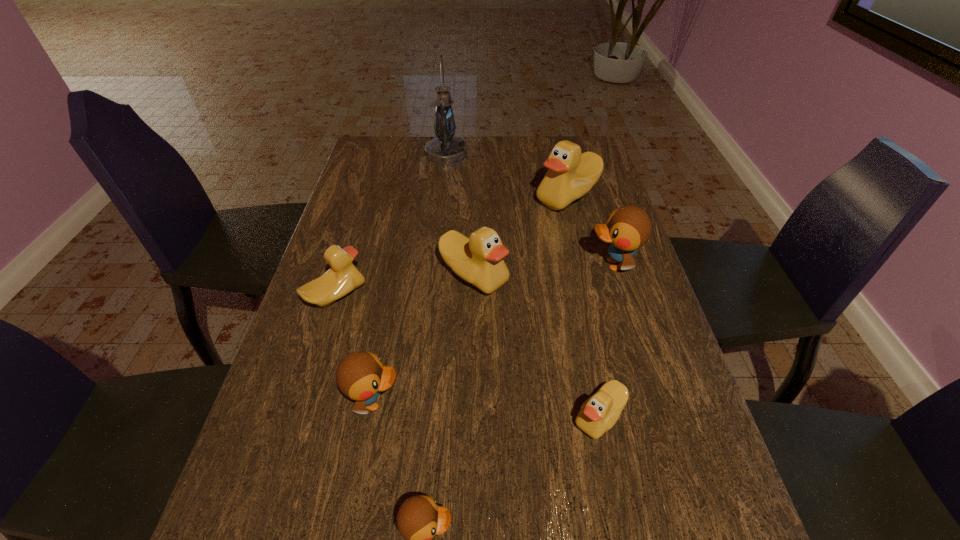
Choose which duck is the third nearest neighbor to the second beige duck from left to right. Please provide its 2D coordinates. Your answer should be formatted as a tuple, i.e. [(x, y)], where the tuple contains the x and y coordinates of a point satisfying the conditions above.

[(628, 228)]

Locate an element on the screen. This screenshot has height=540, width=960. beige duck that is the third closest to the third beige duck from right to left is located at coordinates (599, 413).

Identify which beige duck is the third nearest to the biggest blue duck. Please provide its 2D coordinates. Your answer should be formatted as a tuple, i.e. [(x, y)], where the tuple contains the x and y coordinates of a point satisfying the conditions above.

[(599, 413)]

Choose which blue duck is the nearest neighbor to the second biggest blue duck. Please provide its 2D coordinates. Your answer should be formatted as a tuple, i.e. [(x, y)], where the tuple contains the x and y coordinates of a point satisfying the conditions above.

[(419, 518)]

Choose which blue duck is the second nearest neighbor to the leftmost blue duck. Please provide its 2D coordinates. Your answer should be formatted as a tuple, i.e. [(x, y)], where the tuple contains the x and y coordinates of a point satisfying the conditions above.

[(628, 228)]

Where is `free space that satisfies the following two spatial constraints: 1. at the beak of the second farthest object; 2. at the beak of the second biggest beige duck`? The height and width of the screenshot is (540, 960). free space that satisfies the following two spatial constraints: 1. at the beak of the second farthest object; 2. at the beak of the second biggest beige duck is located at coordinates (587, 275).

Identify the location of vacant space that satisfies the following two spatial constraints: 1. on the front side of the farthest object; 2. on the front-facing side of the second smallest blue duck. (420, 402).